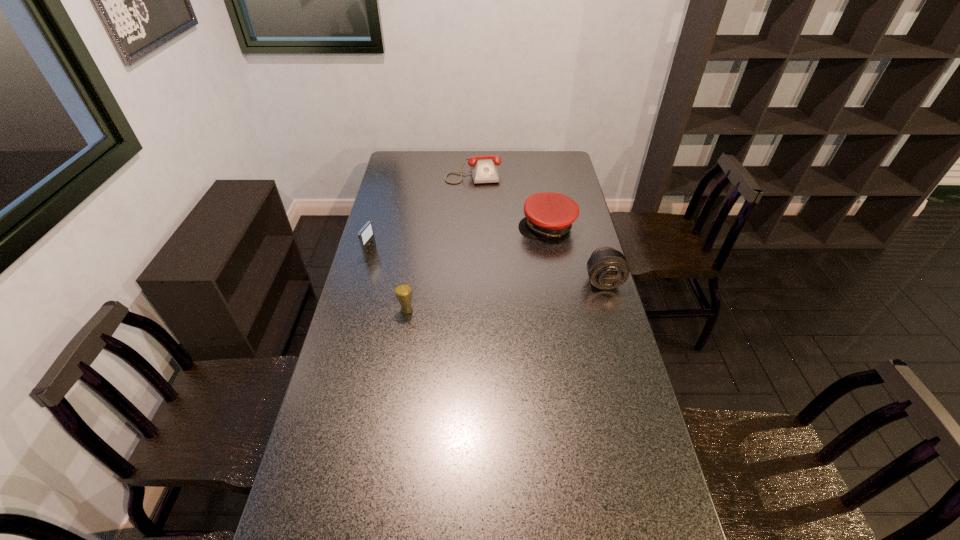
Where is `vacant region located 0.140m on the front-facing side of the telephoto lens`? vacant region located 0.140m on the front-facing side of the telephoto lens is located at coordinates (615, 322).

What are the coordinates of `free location located 0.130m on the front-facing side of the iPod` in the screenshot? It's located at (404, 265).

At what (x,y) coordinates should I click in order to perform the action: click on vacant area situated on the front-facing side of the iPod. Please return your answer as a coordinate pair (x, y). Looking at the image, I should click on (388, 261).

Where is `vacant space located 0.270m on the front-facing side of the iPod`? This screenshot has height=540, width=960. vacant space located 0.270m on the front-facing side of the iPod is located at coordinates (438, 272).

The image size is (960, 540). In order to click on free space located at the front of the cap where the visor is located in this screenshot , I will do `click(492, 294)`.

Identify the location of vacant area situated at the front of the cap where the visor is located. (486, 300).

This screenshot has height=540, width=960. Identify the location of free location located at the front of the cap where the visor is located. (500, 284).

Find the location of a particular element. vacant point located 0.130m on the dial of the telephone is located at coordinates (478, 200).

This screenshot has width=960, height=540. I want to click on free space located 0.380m on the dial of the telephone, so (x=483, y=234).

Identify the location of vacant space positioned 0.400m on the dial of the telephone. The height and width of the screenshot is (540, 960). (484, 237).